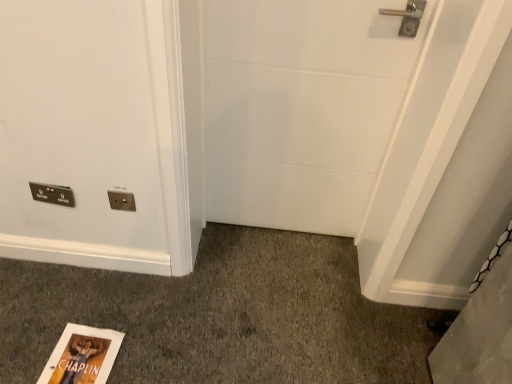
Question: Does point (368, 61) appear closer or farther from the camera than point (57, 200)?

Choices:
 (A) closer
 (B) farther

Answer: (A)

Question: Considering the relative positions of white matte door at center and metallic silver light switch at lower left in the image provided, is white matte door at center to the left or to the right of metallic silver light switch at lower left?

Choices:
 (A) right
 (B) left

Answer: (A)

Question: Estimate the real-world distances between objects in this image. Which object is farther from the matte gold electrical outlet at center?

Choices:
 (A) metallic silver light switch at lower left
 (B) white matte door at center

Answer: (B)

Question: Which object is the farthest from the matte gold electrical outlet at center?

Choices:
 (A) metallic silver light switch at lower left
 (B) white matte door at center

Answer: (B)